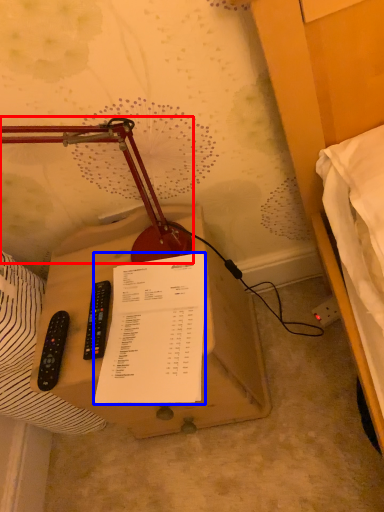
Question: Which object appears farthest to the camera in this image, lamp (highlighted by a red box) or document (highlighted by a blue box)?

Choices:
 (A) lamp
 (B) document

Answer: (B)